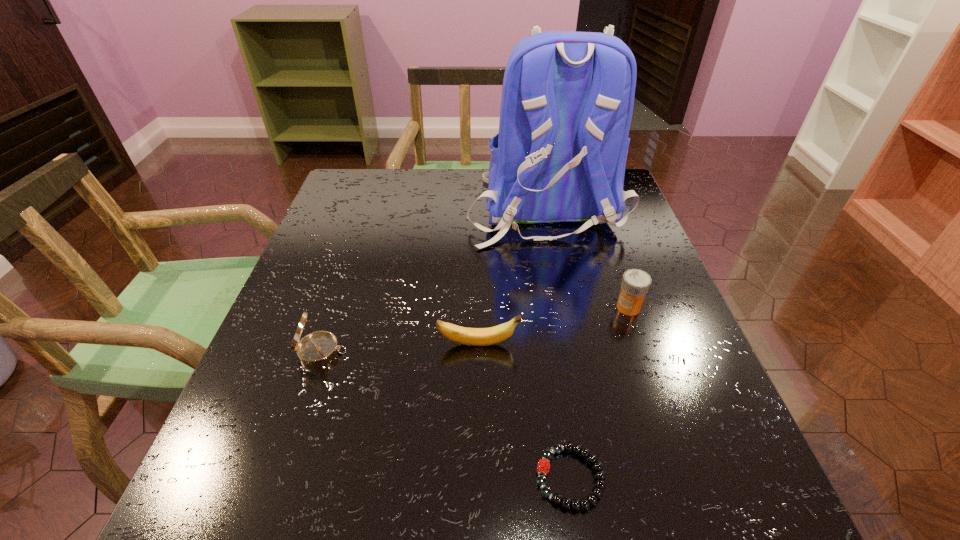
The width and height of the screenshot is (960, 540). I want to click on vacant space that is in between the fourth nearest object and the shortest object, so click(599, 393).

You are a GUI agent. You are given a task and a screenshot of the screen. Output one action in this format:
    pyautogui.click(x=<x>, y=<y>)
    Task: Click on the free space between the farthest object and the compass
    The height and width of the screenshot is (540, 960).
    Given the screenshot: What is the action you would take?
    pyautogui.click(x=433, y=280)

This screenshot has height=540, width=960. Identify the location of empty space between the tallest object and the leftmost object. (433, 280).

Choose which object is the second nearest neighbor to the medicine. Please provide its 2D coordinates. Your answer should be formatted as a tuple, i.e. [(x, y)], where the tuple contains the x and y coordinates of a point satisfying the conditions above.

[(469, 336)]

Locate which object is the closest to the compass. Please provide its 2D coordinates. Your answer should be formatted as a tuple, i.e. [(x, y)], where the tuple contains the x and y coordinates of a point satisfying the conditions above.

[(469, 336)]

Find the location of `vacant region that satisfies the following two spatial constraints: 1. on the label side of the medicine; 2. on the front side of the shortest object`. vacant region that satisfies the following two spatial constraints: 1. on the label side of the medicine; 2. on the front side of the shortest object is located at coordinates (687, 477).

At what (x,y) coordinates should I click in order to perform the action: click on free region that satisfies the following two spatial constraints: 1. on the back of the tallest object; 2. with the dial facing the leftmost object. Please return your answer as a coordinate pair (x, y). Looking at the image, I should click on (573, 352).

The height and width of the screenshot is (540, 960). In order to click on vacant space that satisfies the following two spatial constraints: 1. at the stem of the banana; 2. on the right side of the nearest object in this screenshot , I will do (x=478, y=477).

The width and height of the screenshot is (960, 540). I want to click on vacant space that satisfies the following two spatial constraints: 1. on the back of the backpack; 2. with the dial facing the compass, so click(573, 352).

This screenshot has width=960, height=540. Identify the location of free location that satisfies the following two spatial constraints: 1. on the back of the farthest object; 2. with the dial facing the leftmost object. (573, 352).